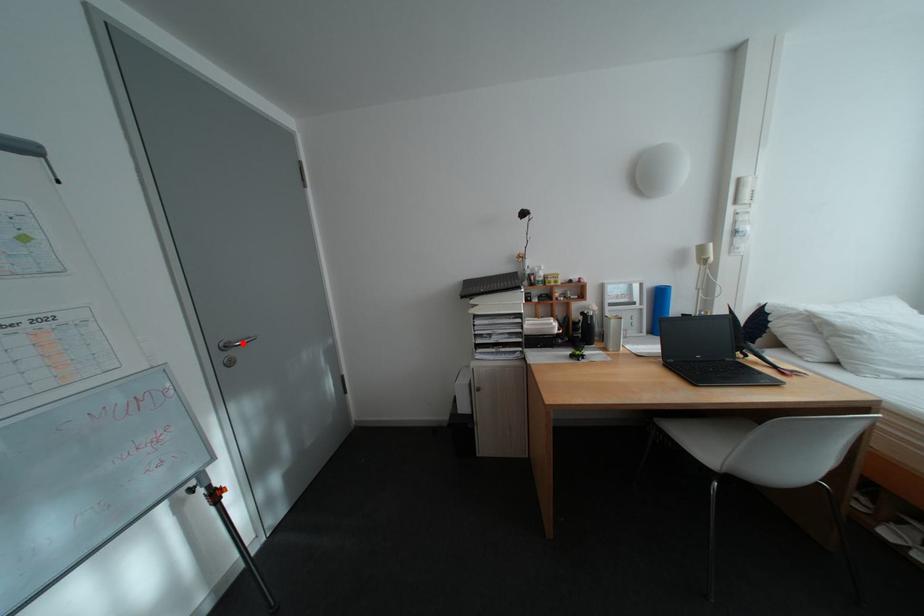
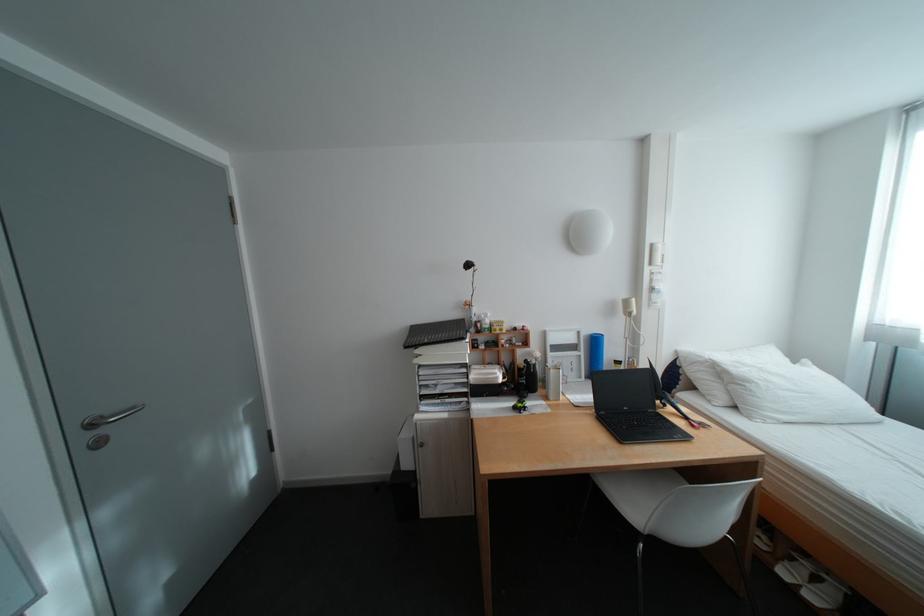
In the second image, find the point that corresponds to the highlighted location in the first image.

(115, 418)